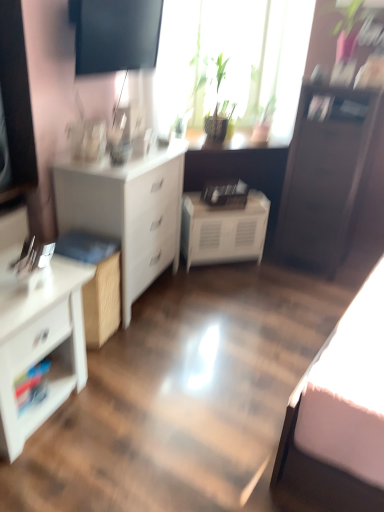
Image resolution: width=384 pixels, height=512 pixels. I want to click on white matte cabinet at center, so pyautogui.click(x=223, y=230).

Describe the element at coordinates (223, 230) in the screenshot. The image size is (384, 512). I see `white matte cabinet at center` at that location.

Identify the location of white glossy chest of drawers at left, the 2th chest of drawers positioned from the back. The width and height of the screenshot is (384, 512). (40, 342).

The width and height of the screenshot is (384, 512). In order to click on white matte chest of drawers at left, which is counted as the first chest of drawers, starting from the back in this screenshot , I will do `click(128, 211)`.

The width and height of the screenshot is (384, 512). In order to click on white matte cabinet at center in this screenshot , I will do `click(223, 230)`.

Considering the relative sizes of white matte chest of drawers at left, which is counted as the first chest of drawers, starting from the back, and dark wood file cabinet at right in the image provided, is white matte chest of drawers at left, which is counted as the first chest of drawers, starting from the back, thinner than dark wood file cabinet at right?

No, white matte chest of drawers at left, which is counted as the first chest of drawers, starting from the back, is not thinner than dark wood file cabinet at right.

Locate an element on the screen. Image resolution: width=384 pixels, height=512 pixels. file cabinet behind the white matte chest of drawers at left, the second chest of drawers in the front-to-back sequence is located at coordinates (326, 175).

Is point (96, 207) behind point (347, 211)?

No, it is in front of (347, 211).

Is white matte chest of drawers at left, the second chest of drawers in the front-to-back sequence, turned away from dark wood file cabinet at right?

No.

How different are the orientations of green leafy plant at upper center and white glossy shelf at lower left in degrees?

45.3 degrees separate the facing orientations of green leafy plant at upper center and white glossy shelf at lower left.

In the image, is green leafy plant at upper center on the left side or the right side of white glossy shelf at lower left?

Based on their positions, green leafy plant at upper center is located to the right of white glossy shelf at lower left.

Looking at their sizes, would you say green leafy plant at upper center is wider or thinner than white glossy shelf at lower left?

Clearly, green leafy plant at upper center has less width compared to white glossy shelf at lower left.

Considering the positions of point (163, 120) and point (41, 367), is point (163, 120) closer or farther from the camera than point (41, 367)?

Point (163, 120).

Choose the correct answer: Is white glossy chest of drawers at left, acting as the first chest of drawers starting from the front, inside green leafy plant at upper center or outside it?

white glossy chest of drawers at left, acting as the first chest of drawers starting from the front, lies outside green leafy plant at upper center.

Is white glossy chest of drawers at left, the 2th chest of drawers positioned from the back, far away from green leafy plant at upper center?

Yes.

From the image's perspective, who appears lower, white glossy chest of drawers at left, acting as the first chest of drawers starting from the front, or green leafy plant at upper center?

white glossy chest of drawers at left, acting as the first chest of drawers starting from the front, appears lower in the image.

Considering the positions of objects white glossy chest of drawers at left, acting as the first chest of drawers starting from the front, and green leafy plant at upper center in the image provided, who is in front, white glossy chest of drawers at left, acting as the first chest of drawers starting from the front, or green leafy plant at upper center?

white glossy chest of drawers at left, acting as the first chest of drawers starting from the front, is more forward.

Considering the relative sizes of white matte chest of drawers at left, the second chest of drawers in the front-to-back sequence, and white matte cabinet at center in the image provided, is white matte chest of drawers at left, the second chest of drawers in the front-to-back sequence, bigger than white matte cabinet at center?

Correct, white matte chest of drawers at left, the second chest of drawers in the front-to-back sequence, is larger in size than white matte cabinet at center.

Considering the sizes of white matte chest of drawers at left, which is counted as the first chest of drawers, starting from the back, and white matte cabinet at center in the image, is white matte chest of drawers at left, which is counted as the first chest of drawers, starting from the back, wider or thinner than white matte cabinet at center?

Clearly, white matte chest of drawers at left, which is counted as the first chest of drawers, starting from the back, has more width compared to white matte cabinet at center.

How many degrees apart are the facing directions of white matte chest of drawers at left, which is counted as the first chest of drawers, starting from the back, and white matte cabinet at center?

52.9 degrees.

Can you confirm if dark wood file cabinet at right is taller than white glossy chest of drawers at left, acting as the first chest of drawers starting from the front?

Indeed, dark wood file cabinet at right has a greater height compared to white glossy chest of drawers at left, acting as the first chest of drawers starting from the front.

Is there a large distance between dark wood file cabinet at right and white glossy chest of drawers at left, acting as the first chest of drawers starting from the front?

Absolutely, dark wood file cabinet at right is distant from white glossy chest of drawers at left, acting as the first chest of drawers starting from the front.

Can you confirm if dark wood file cabinet at right is wider than white glossy chest of drawers at left, acting as the first chest of drawers starting from the front?

Indeed, dark wood file cabinet at right has a greater width compared to white glossy chest of drawers at left, acting as the first chest of drawers starting from the front.

Is dark wood file cabinet at right at the left side of white glossy chest of drawers at left, acting as the first chest of drawers starting from the front?

In fact, dark wood file cabinet at right is to the right of white glossy chest of drawers at left, acting as the first chest of drawers starting from the front.

Consider the image. Can you confirm if dark wood file cabinet at right is smaller than white matte cabinet at center?

No, dark wood file cabinet at right is not smaller than white matte cabinet at center.

Is dark wood file cabinet at right wider or thinner than white matte cabinet at center?

Clearly, dark wood file cabinet at right has more width compared to white matte cabinet at center.

Could you tell me if dark wood file cabinet at right is turned towards white matte cabinet at center?

No, dark wood file cabinet at right does not turn towards white matte cabinet at center.

Relative to dark wood file cabinet at right, is green leafy plant at upper center in front or behind?

Clearly, green leafy plant at upper center is behind dark wood file cabinet at right.

From the image's perspective, which is below, green leafy plant at upper center or dark wood file cabinet at right?

dark wood file cabinet at right is shown below in the image.

Choose the correct answer: Is green leafy plant at upper center inside dark wood file cabinet at right or outside it?

green leafy plant at upper center is outside dark wood file cabinet at right.

Can you tell me how much green leafy plant at upper center and dark wood file cabinet at right differ in facing direction?

The angle between the facing direction of green leafy plant at upper center and the facing direction of dark wood file cabinet at right is 48.6 degrees.

Identify the location of the chest of drawers that is the 1st one when counting downward from the dark wood file cabinet at right (from the image's perspective). (128, 211).

Identify the location of shelf below the green leafy plant at upper center (from a real-world perspective). (42, 380).

When comparing their distances from green leafy plant at upper center, does white glossy shelf at lower left or white glossy chest of drawers at left, acting as the first chest of drawers starting from the front, seem further?

white glossy shelf at lower left is positioned further to the anchor green leafy plant at upper center.

Looking at the image, which one is located further to green leafy plant at upper center, white matte cabinet at center or dark wood file cabinet at right?

white matte cabinet at center is further to green leafy plant at upper center.

Based on the photo, looking at the image, which one is located further to white matte chest of drawers at left, the second chest of drawers in the front-to-back sequence, white glossy shelf at lower left or white glossy chest of drawers at left, the 2th chest of drawers positioned from the back?

Based on the image, white glossy shelf at lower left appears to be further to white matte chest of drawers at left, the second chest of drawers in the front-to-back sequence.

Based on their spatial positions, is white matte cabinet at center or white matte chest of drawers at left, which is counted as the first chest of drawers, starting from the back, closer to white glossy chest of drawers at left, the 2th chest of drawers positioned from the back?

white matte chest of drawers at left, which is counted as the first chest of drawers, starting from the back, lies closer to white glossy chest of drawers at left, the 2th chest of drawers positioned from the back, than the other object.

Based on the photo, considering their positions, is white glossy shelf at lower left positioned closer to white glossy chest of drawers at left, acting as the first chest of drawers starting from the front, than white matte chest of drawers at left, the second chest of drawers in the front-to-back sequence?

white glossy shelf at lower left is positioned closer to the anchor white glossy chest of drawers at left, acting as the first chest of drawers starting from the front.

Based on their spatial positions, is white matte cabinet at center or dark wood file cabinet at right closer to white glossy chest of drawers at left, the 2th chest of drawers positioned from the back?

white matte cabinet at center is positioned closer to the anchor white glossy chest of drawers at left, the 2th chest of drawers positioned from the back.

Considering their positions, is white matte chest of drawers at left, the second chest of drawers in the front-to-back sequence, positioned closer to white matte cabinet at center than green leafy plant at upper center?

Based on the image, white matte chest of drawers at left, the second chest of drawers in the front-to-back sequence, appears to be nearer to white matte cabinet at center.

From the image, which object appears to be farther from white matte chest of drawers at left, the second chest of drawers in the front-to-back sequence, dark wood file cabinet at right or white glossy shelf at lower left?

The object further to white matte chest of drawers at left, the second chest of drawers in the front-to-back sequence, is dark wood file cabinet at right.

Where is `the chest of drawers positioned between white glossy shelf at lower left and white matte cabinet at center from near to far`? the chest of drawers positioned between white glossy shelf at lower left and white matte cabinet at center from near to far is located at coordinates (128, 211).

The height and width of the screenshot is (512, 384). Identify the location of file cabinet between green leafy plant at upper center and white glossy chest of drawers at left, acting as the first chest of drawers starting from the front, in the vertical direction. (326, 175).

The width and height of the screenshot is (384, 512). In order to click on shelf between white glossy chest of drawers at left, the 2th chest of drawers positioned from the back, and white matte cabinet at center from front to back in this screenshot , I will do [x=42, y=380].

Where is `chest of drawers between green leafy plant at upper center and white matte cabinet at center in the up-down direction`? chest of drawers between green leafy plant at upper center and white matte cabinet at center in the up-down direction is located at coordinates (128, 211).